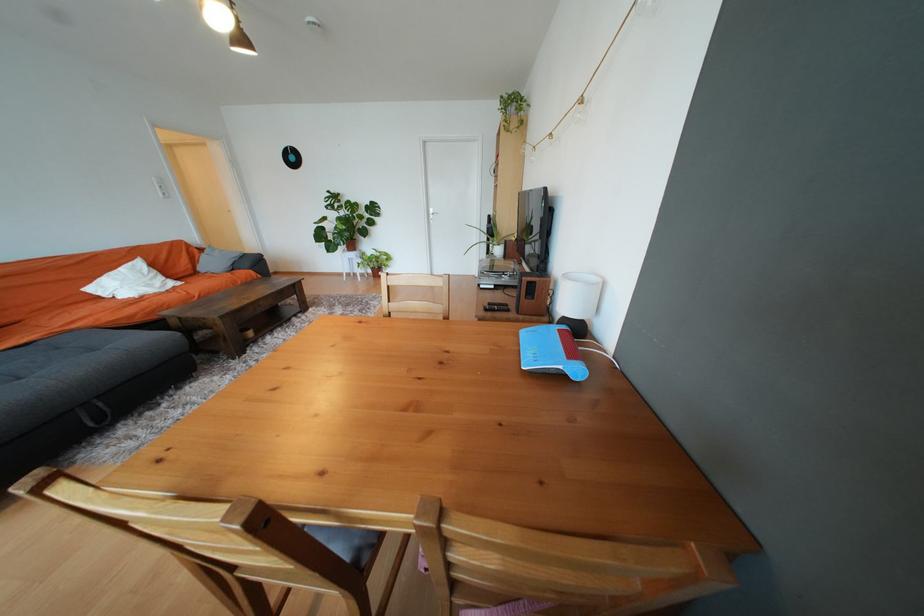
Where would you sit the sofa sitting surface? Please return your answer as a coordinate pair (x, y).

(90, 355)